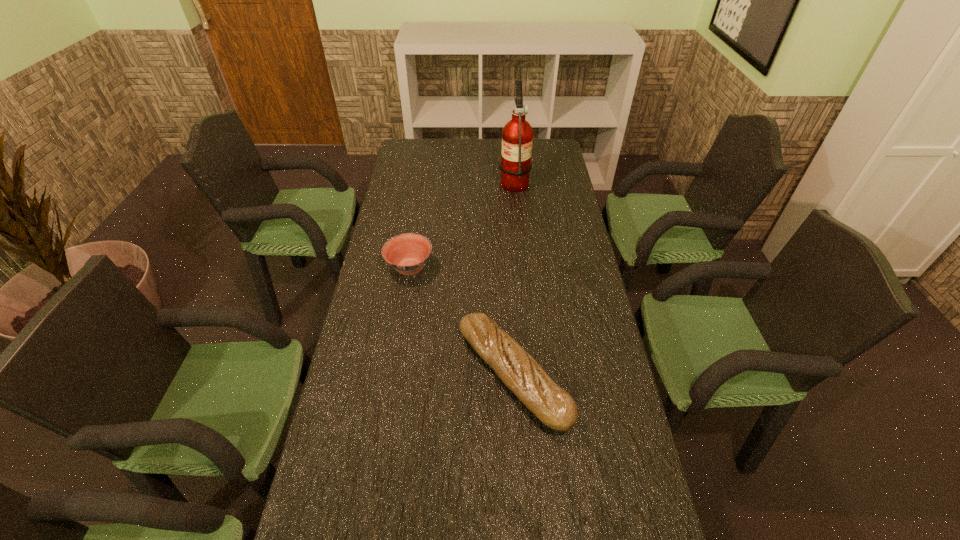
Where is `the tallest object`? The width and height of the screenshot is (960, 540). the tallest object is located at coordinates (517, 136).

Locate an element on the screen. fire extinguisher is located at coordinates (517, 136).

At what (x,y) coordinates should I click in order to perform the action: click on baguet. Please return your answer as a coordinate pair (x, y). Image resolution: width=960 pixels, height=540 pixels. Looking at the image, I should click on pyautogui.click(x=552, y=405).

Where is `the leftmost object`? The image size is (960, 540). the leftmost object is located at coordinates pos(407,253).

Identify the location of the second nearest object. (407, 253).

Locate an element on the screen. The width and height of the screenshot is (960, 540). free space located on the nozzle and handle of the farthest object is located at coordinates click(425, 181).

You are a GUI agent. You are given a task and a screenshot of the screen. Output one action in this format:
    pyautogui.click(x=<x>, y=<y>)
    Task: Click on the vacant point located on the nozzle and handle of the farthest object
    Image resolution: width=960 pixels, height=540 pixels.
    Given the screenshot: What is the action you would take?
    pyautogui.click(x=446, y=181)

Locate an element on the screen. The image size is (960, 540). free space located on the nozzle and handle of the farthest object is located at coordinates (416, 181).

Locate an element on the screen. vacant space located on the back of the nearest object is located at coordinates (505, 244).

Identify the location of vacant space situated on the back of the second nearest object. The height and width of the screenshot is (540, 960). (415, 239).